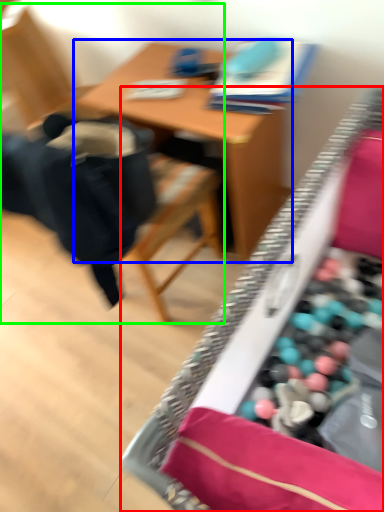
Question: Based on their relative distances, which object is farther from desk (highlighted by a red box)? Choose from table (highlighted by a blue box) and chair (highlighted by a green box).

Choices:
 (A) table
 (B) chair

Answer: (B)